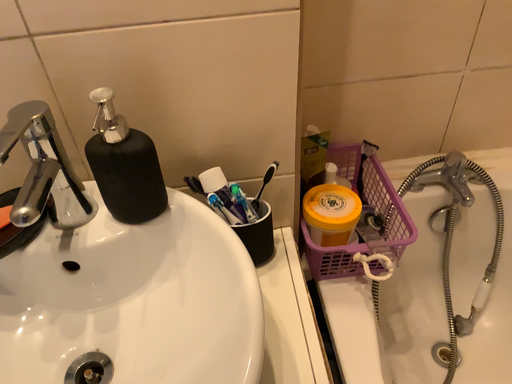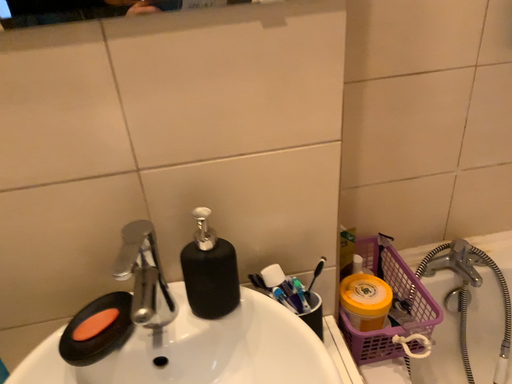
Question: How did the camera likely rotate when shooting the video?

Choices:
 (A) rotated upward
 (B) rotated downward

Answer: (A)